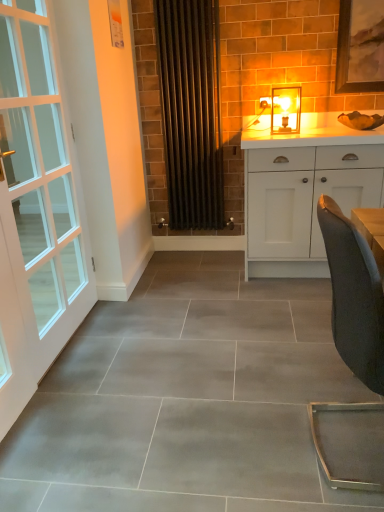
You are a GUI agent. You are given a task and a screenshot of the screen. Output one action in this format:
    pyautogui.click(x=<x>, y=<y>)
    Task: Click on the white glass door at left
    The width and height of the screenshot is (384, 512).
    Given the screenshot: What is the action you would take?
    pyautogui.click(x=35, y=211)

What are the coordinates of `white matte cabinet at right` in the screenshot? It's located at (304, 191).

Between black metal radiator at center and matte glass lampshade at upper center, which one appears on the left side from the viewer's perspective?

black metal radiator at center is more to the left.

Locate an element on the screen. This screenshot has height=512, width=384. light fixture lying on the right of black metal radiator at center is located at coordinates (286, 109).

Is black metal radiator at center not inside matte glass lampshade at upper center?

Yes, black metal radiator at center is not within matte glass lampshade at upper center.

Considering the relative sizes of black metal radiator at center and matte glass lampshade at upper center in the image provided, is black metal radiator at center bigger than matte glass lampshade at upper center?

Indeed, black metal radiator at center has a larger size compared to matte glass lampshade at upper center.

Which is closer, (51,157) or (375,319)?

Point (51,157) appears to be farther away from the viewer than point (375,319).

Considering the positions of objects white glass door at left and dark gray fabric chair at right in the image provided, who is more to the left, white glass door at left or dark gray fabric chair at right?

→ Positioned to the left is white glass door at left.

Between white glass door at left and dark gray fabric chair at right, which one has smaller size?

dark gray fabric chair at right is smaller.

Is point (61, 135) closer or farther from the camera than point (158, 71)?

Point (61, 135) is positioned closer to the camera compared to point (158, 71).

Can you see white glass door at left touching black metal radiator at center?

No, white glass door at left is not beside black metal radiator at center.

Where is `door that appears in front of the black metal radiator at center`? door that appears in front of the black metal radiator at center is located at coordinates (35, 211).

From the image's perspective, between matte glass lampshade at upper center and black metal radiator at center, who is located below?

From the image's view, matte glass lampshade at upper center is below.

In the scene shown: From a real-world perspective, is matte glass lampshade at upper center located beneath black metal radiator at center?

No, from a real-world perspective, matte glass lampshade at upper center is not under black metal radiator at center.

Which of these two, matte glass lampshade at upper center or black metal radiator at center, stands taller?

black metal radiator at center.

Measure the distance between matte glass lampshade at upper center and black metal radiator at center.

matte glass lampshade at upper center is 24.30 inches from black metal radiator at center.

Looking at their sizes, would you say white matte cabinet at right is wider or thinner than white glass door at left?

In the image, white matte cabinet at right appears to be wider than white glass door at left.

Are white matte cabinet at right and white glass door at left beside each other?

No, white matte cabinet at right is not beside white glass door at left.

Between point (298, 217) and point (14, 388), which one is positioned in front?

The point (14, 388) is closer.

From the image's perspective, which one is positioned lower, white glass door at left or white matte cabinet at right?

white glass door at left appears lower in the image.

Is point (2, 330) closer or farther from the camera than point (356, 139)?

Point (2, 330).

Which object is closer to the camera taking this photo, white glass door at left or white matte cabinet at right?

white glass door at left is in front.

Considering the sizes of objects white glass door at left and white matte cabinet at right in the image provided, who is thinner, white glass door at left or white matte cabinet at right?

With smaller width is white glass door at left.

From a real-world perspective, does black metal radiator at center stand above white matte cabinet at right?

Yes.

Is black metal radiator at center aimed at white matte cabinet at right?

No, black metal radiator at center is not aimed at white matte cabinet at right.

Between point (174, 77) and point (277, 219), which one is positioned behind?

The point (174, 77) is farther.

Identify the location of radiator below the matte glass lampshade at upper center (from a real-world perspective). (191, 111).

Locate an element on the screen. The image size is (384, 512). door positioned vertically above the dark gray fabric chair at right (from a real-world perspective) is located at coordinates (35, 211).

Looking at the image, which one is located closer to white matte cabinet at right, white glass door at left or matte glass lampshade at upper center?

matte glass lampshade at upper center is positioned closer to the anchor white matte cabinet at right.

From the image, which object appears to be farther from black metal radiator at center, white matte cabinet at right or dark gray fabric chair at right?

dark gray fabric chair at right is positioned further to the anchor black metal radiator at center.

Estimate the real-world distances between objects in this image. Which object is further from white matte cabinet at right, black metal radiator at center or matte glass lampshade at upper center?

black metal radiator at center is positioned further to the anchor white matte cabinet at right.

Based on their spatial positions, is white matte cabinet at right or white glass door at left further from black metal radiator at center?

white glass door at left.

Based on their spatial positions, is dark gray fabric chair at right or matte glass lampshade at upper center further from white matte cabinet at right?

dark gray fabric chair at right is further to white matte cabinet at right.

Based on their spatial positions, is matte glass lampshade at upper center or white glass door at left further from black metal radiator at center?

white glass door at left lies further to black metal radiator at center than the other object.

Consider the image. Looking at the image, which one is located further to black metal radiator at center, white glass door at left or matte glass lampshade at upper center?

Among the two, white glass door at left is located further to black metal radiator at center.

Considering their positions, is black metal radiator at center positioned further to white matte cabinet at right than dark gray fabric chair at right?

dark gray fabric chair at right lies further to white matte cabinet at right than the other object.

Where is `chair between white glass door at left and white matte cabinet at right`? chair between white glass door at left and white matte cabinet at right is located at coordinates (354, 296).

Find the location of a particular element. The height and width of the screenshot is (512, 384). light fixture situated between black metal radiator at center and white matte cabinet at right from left to right is located at coordinates (286, 109).

Identify the location of door positioned between dark gray fabric chair at right and matte glass lampshade at upper center from near to far. (35, 211).

Find the location of a particular element. This screenshot has height=512, width=384. cabinetry between dark gray fabric chair at right and matte glass lampshade at upper center along the z-axis is located at coordinates (304, 191).